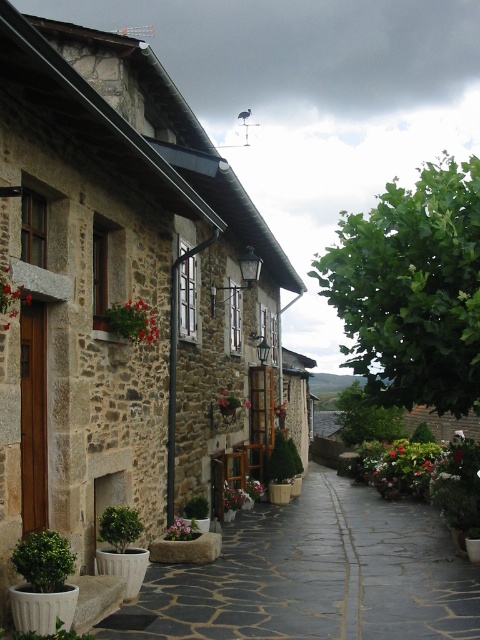
Is red matte flower at upper left thinner than pink matte flower at center?

Correct, red matte flower at upper left's width is less than pink matte flower at center's.

Is point (9, 310) in front of point (173, 532)?

Yes, point (9, 310) is closer to viewer.

Locate an element on the screen. The height and width of the screenshot is (640, 480). red matte flower at upper left is located at coordinates (11, 294).

Consider the image. Is green matte potted plant at lower left taller than green matte flower at center?

No, green matte potted plant at lower left is not taller than green matte flower at center.

What are the coordinates of `green matte potted plant at lower left` in the screenshot? It's located at (44, 561).

Can you confirm if green matte flower at center is positioned below green leafy bush at lower left?

No, green matte flower at center is not below green leafy bush at lower left.

Does green matte flower at center have a smaller size compared to green leafy bush at lower left?

No.

At what (x,y) coordinates should I click in order to perform the action: click on green matte flower at center. Please return your answer as a coordinate pair (x, y). Looking at the image, I should click on (133, 321).